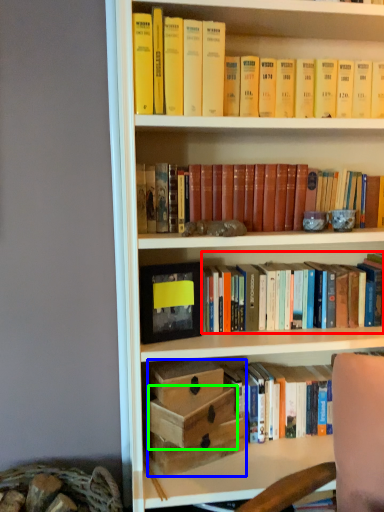
Question: Which is farther away from book (highlighted by a red box)? box (highlighted by a blue box) or box (highlighted by a green box)?

Choices:
 (A) box
 (B) box

Answer: (B)